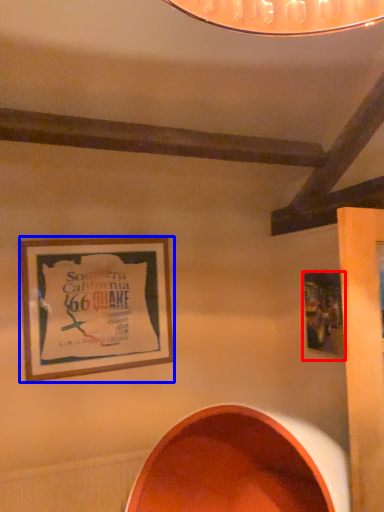
Question: Which point is closer to the camera, picture frame (highlighted by a red box) or picture frame (highlighted by a blue box)?

Choices:
 (A) picture frame
 (B) picture frame

Answer: (A)